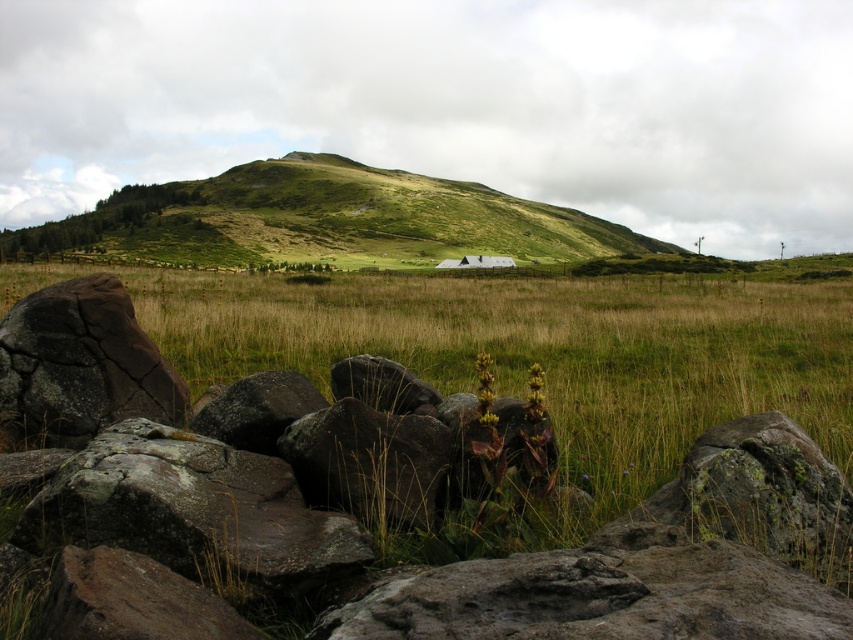
You are a hiker who wants to place a small backpack between the rusty stone boulder at lower left and the dark brown cracked rock at lower left. Which rock should you place it closer to if you want the backpack to be less likely to be hit by someone walking around the larger rock?

You should place the backpack closer to the rusty stone boulder at lower left because it is smaller than the dark brown cracked rock at lower left, so the larger rock is more likely to have people walking around it and might hit the backpack.

You are standing in the rural landscape and want to walk towards the green grassy hillside at upper center and the dark brown cracked rock at lower left. Which object will you reach first?

You will reach the dark brown cracked rock at lower left first because it is closer to you than the green grassy hillside at upper center, which is further away.

You are standing at the point labeled as point (325, 220) in the image. Looking around, you see the grassy fields and distant hill. What direction should you walk to reach the green grassy hillside at upper center?

The point (325, 220) is labeled as the green grassy hillside at upper center, so you are already at the green grassy hillside at upper center.